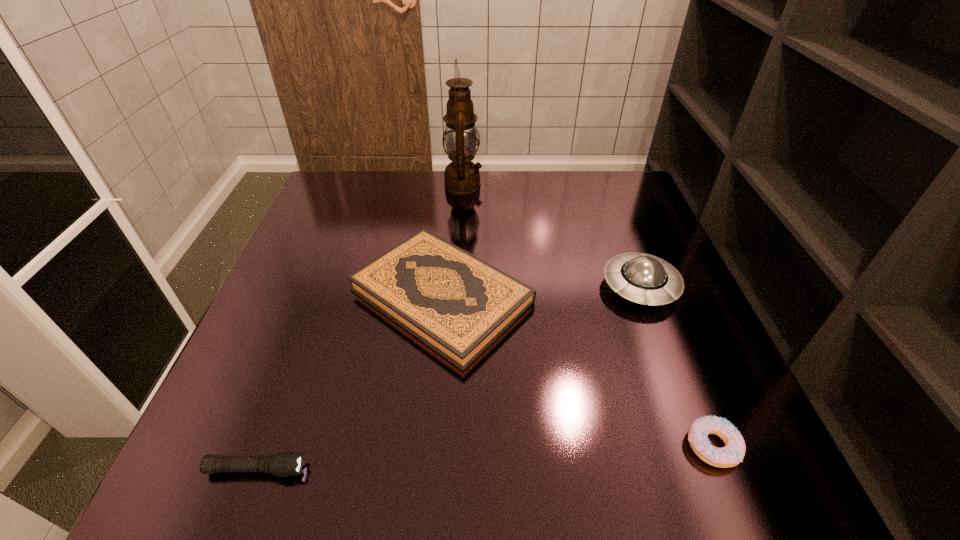
At what (x,y) coordinates should I click in order to perform the action: click on vacant area at the near edge. Please return your answer as a coordinate pair (x, y). Image resolution: width=960 pixels, height=540 pixels. Looking at the image, I should click on pyautogui.click(x=608, y=490).

Locate an element on the screen. blank space at the left edge is located at coordinates (324, 294).

In the image, there is a desktop. At what (x,y) coordinates should I click in order to perform the action: click on free space at the right edge. Please return your answer as a coordinate pair (x, y). This screenshot has width=960, height=540. Looking at the image, I should click on (648, 246).

In the image, there is a desktop. At what (x,y) coordinates should I click in order to perform the action: click on free region at the far left corner. Please return your answer as a coordinate pair (x, y). Looking at the image, I should click on (365, 187).

Identify the location of vacant region at the far right corner of the desktop. (627, 213).

Identify the location of vacant space in between the fourth shortest object and the oil lamp. (552, 236).

The width and height of the screenshot is (960, 540). I want to click on vacant area between the doughnut and the hardback book, so click(577, 370).

In order to click on free space that is in between the flashlight and the oil lamp in this screenshot , I will do `click(360, 327)`.

Locate an element on the screen. Image resolution: width=960 pixels, height=540 pixels. vacant space that's between the flashlight and the fourth shortest object is located at coordinates (448, 378).

I want to click on unoccupied position between the flashlight and the hardback book, so click(x=349, y=382).